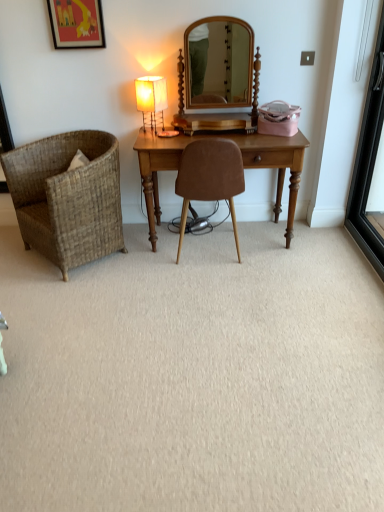
Question: In terms of size, does brown suede chair at center, marked as the first chair in a right-to-left arrangement, appear bigger or smaller than matte black picture frame at upper left?

Choices:
 (A) big
 (B) small

Answer: (A)

Question: Would you say brown suede chair at center, which is counted as the 2th chair, starting from the left, is inside or outside matte black picture frame at upper left?

Choices:
 (A) outside
 (B) inside

Answer: (A)

Question: Which object is positioned closest to the black glass screen door at right?

Choices:
 (A) matte black picture frame at upper left
 (B) woven brown chair at left, arranged as the second chair when viewed from the right
 (C) wooden desk at center
 (D) matte fabric table lamp at center
 (E) brown suede chair at center, which is counted as the 2th chair, starting from the left

Answer: (C)

Question: Which object is positioned closest to the matte fabric table lamp at center?

Choices:
 (A) woven brown chair at left, marked as the 1th chair in a left-to-right arrangement
 (B) brown suede chair at center, which is counted as the 2th chair, starting from the left
 (C) wooden desk at center
 (D) black glass screen door at right
 (E) matte black picture frame at upper left

Answer: (E)